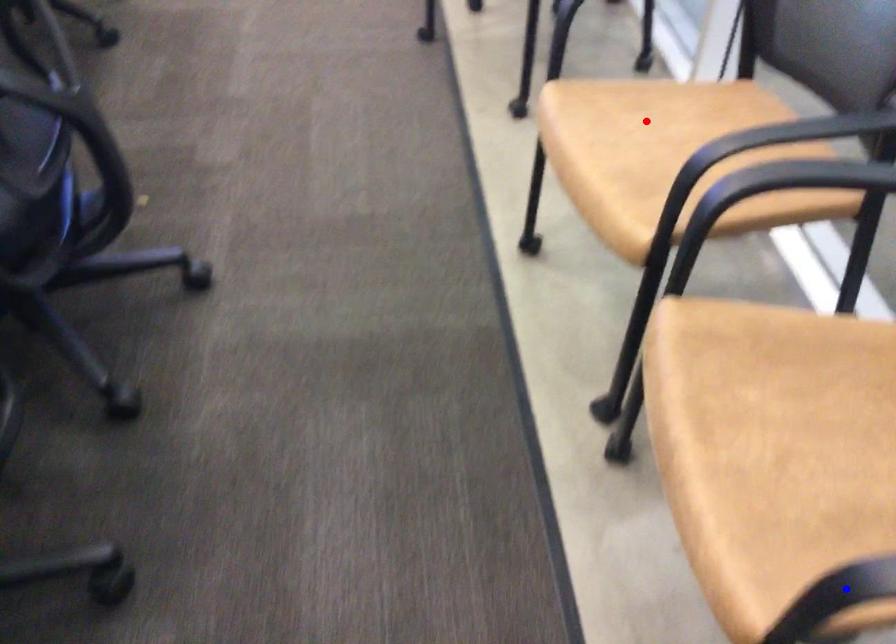
Question: In the image, two points are highlighted. Which point is nearer to the camera? Reply with the corresponding letter.

Choices:
 (A) blue point
 (B) red point

Answer: (A)